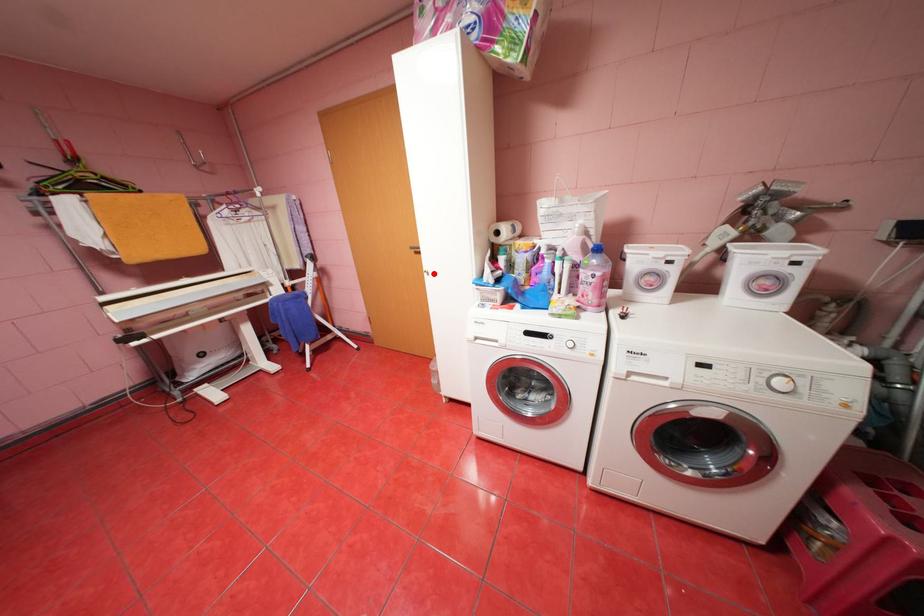
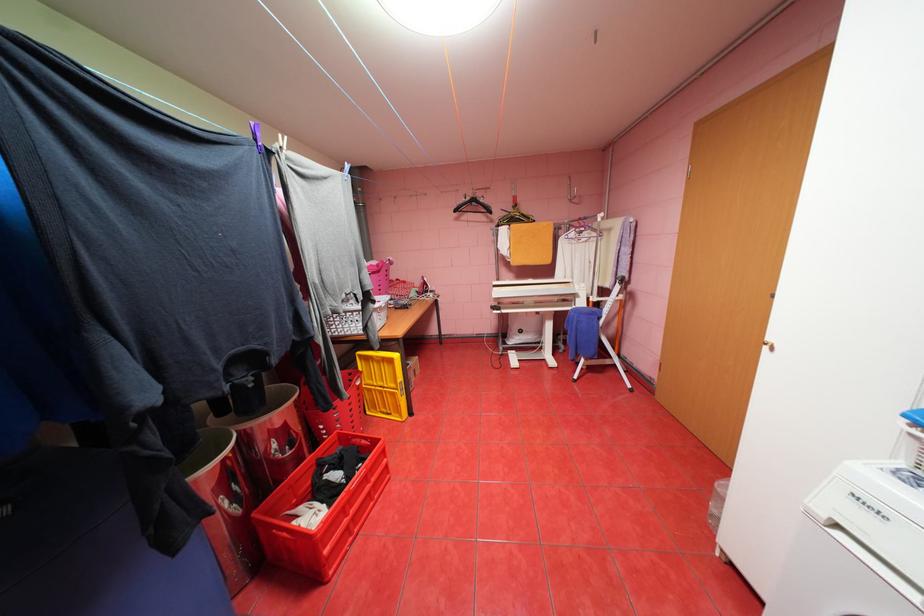
In the second image, find the point that corresponds to the highlighted location in the first image.

(774, 347)